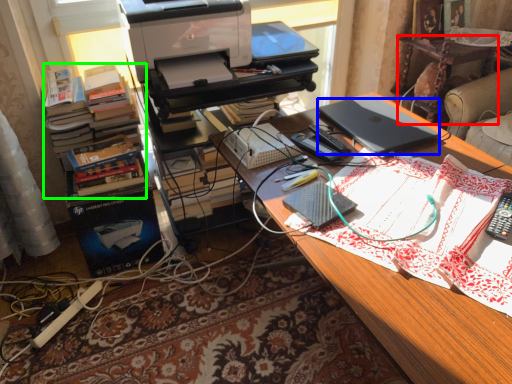
Question: Considering the real-world distances, which object is closest to computer desk (highlighted by a red box)? laptop (highlighted by a blue box) or book (highlighted by a green box).

Choices:
 (A) laptop
 (B) book

Answer: (A)